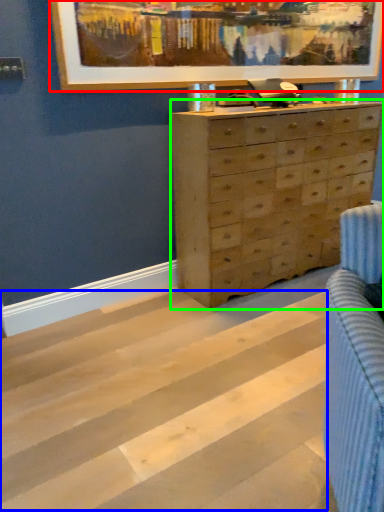
Question: Considering the real-world distances, which object is farthest from picture frame (highlighted by a red box)? stripe (highlighted by a blue box) or chest of drawers (highlighted by a green box)?

Choices:
 (A) stripe
 (B) chest of drawers

Answer: (A)